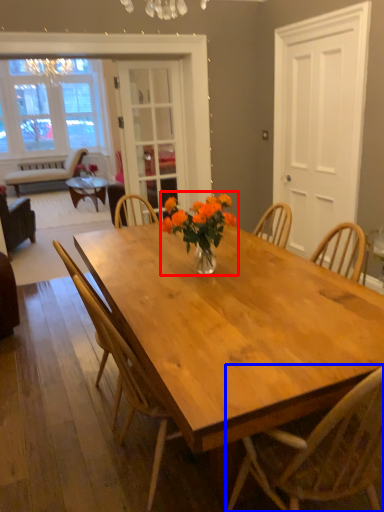
Question: Which object appears closest to the camera in this image, floral arrangement (highlighted by a red box) or chair (highlighted by a blue box)?

Choices:
 (A) floral arrangement
 (B) chair

Answer: (B)